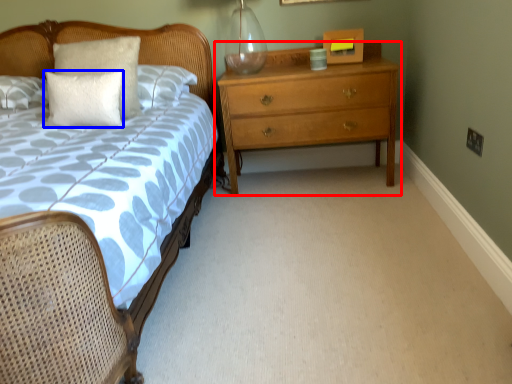
Question: Which object appears farthest to the camera in this image, chest of drawers (highlighted by a red box) or pillow (highlighted by a blue box)?

Choices:
 (A) chest of drawers
 (B) pillow

Answer: (A)